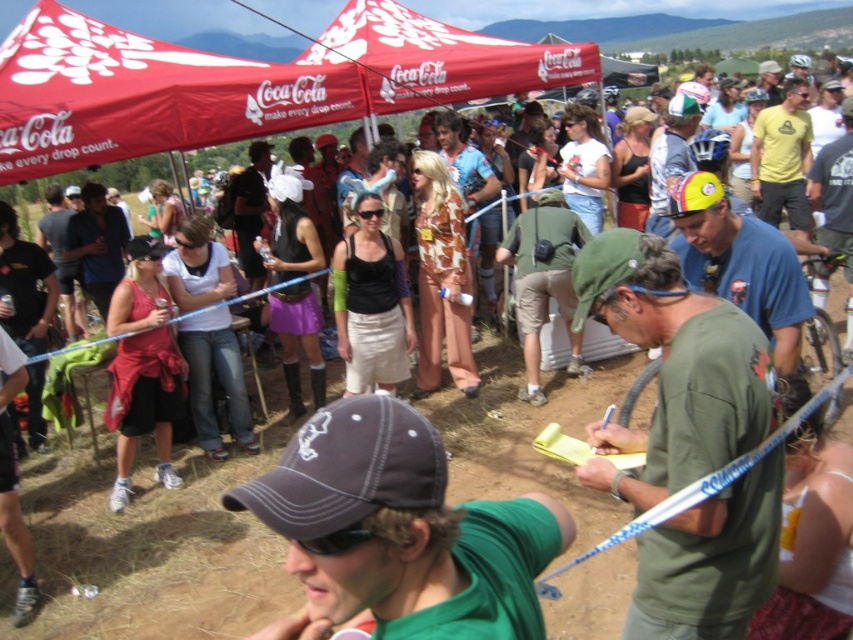
Can you confirm if red fabric canopy at upper center is positioned above green matte shirt at center?

Yes, red fabric canopy at upper center is above green matte shirt at center.

Does point (422, 77) lie behind point (733, 410)?

Yes.

This screenshot has width=853, height=640. Find the location of `red fabric canopy at upper center`. red fabric canopy at upper center is located at coordinates (241, 83).